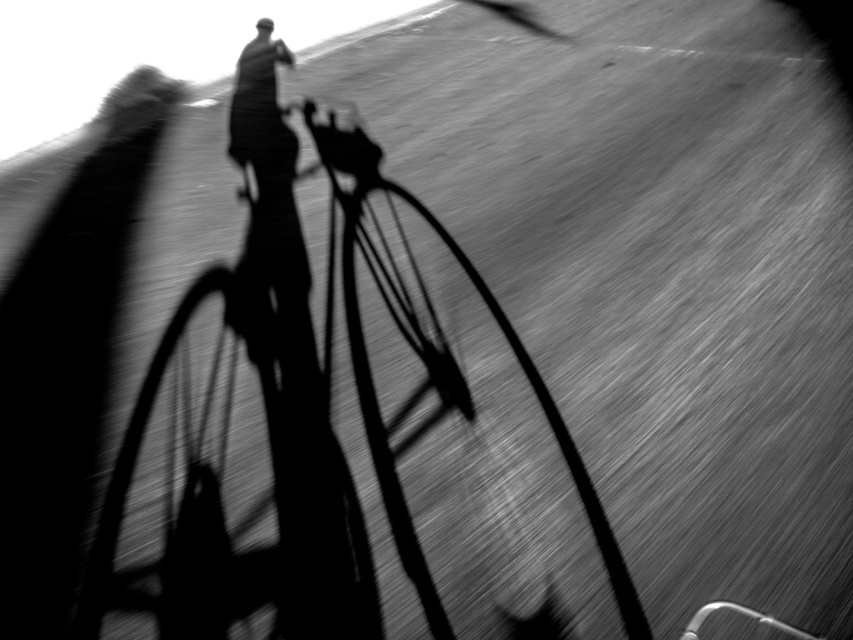
Measure the distance from smooth black wheel at center to smooth metal bicycle wheel at center.

They are 25.87 inches apart.

Between smooth black wheel at center and smooth metal bicycle wheel at center, which one is positioned higher?

smooth metal bicycle wheel at center

Who is more distant from viewer, [178,337] or [614,545]?

Point [178,337]

This screenshot has height=640, width=853. Find the location of `smooth black wheel at center`. smooth black wheel at center is located at coordinates click(222, 486).

Who is shorter, silhouette metal bicycle at center or smooth black wheel at center?

smooth black wheel at center is shorter.

Between silhouette metal bicycle at center and smooth black wheel at center, which one appears on the left side from the viewer's perspective?

smooth black wheel at center

Does point (206, 298) lie in front of point (196, 588)?

That is False.

This screenshot has height=640, width=853. I want to click on silhouette metal bicycle at center, so pyautogui.click(x=322, y=429).

Between silhouette metal bicycle at center and smooth metal bicycle wheel at center, which one appears on the left side from the viewer's perspective?

From the viewer's perspective, silhouette metal bicycle at center appears more on the left side.

Who is more distant from viewer, [141,432] or [399,524]?

The point [141,432] is behind.

Is point (461, 381) positioned before point (352, 196)?

Yes, it is.

In order to click on silhouette metal bicycle at center in this screenshot , I will do `click(322, 429)`.